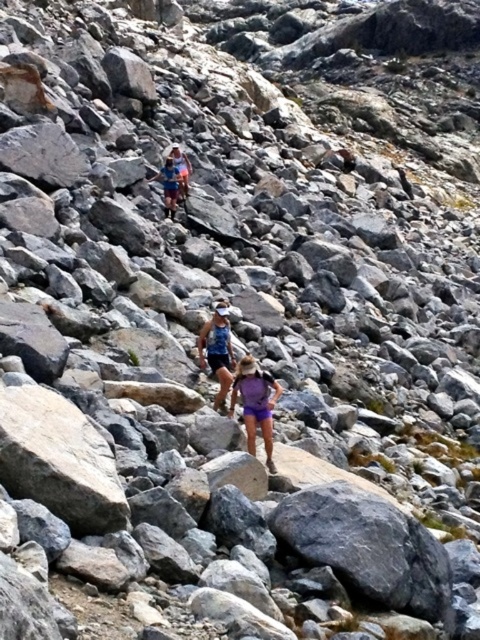
Is purple fabric backpack at center above blue fabric shorts at center?

Incorrect, purple fabric backpack at center is not positioned above blue fabric shorts at center.

Does purple fabric backpack at center have a greater width compared to blue fabric shorts at center?

In fact, purple fabric backpack at center might be narrower than blue fabric shorts at center.

Image resolution: width=480 pixels, height=640 pixels. Find the location of `purple fabric backpack at center`. purple fabric backpack at center is located at coordinates (255, 403).

At what (x,y) coordinates should I click in order to perform the action: click on purple fabric backpack at center. Please return your answer as a coordinate pair (x, y). Image resolution: width=480 pixels, height=640 pixels. Looking at the image, I should click on (255, 403).

Is point (262, 404) farther from camera compared to point (182, 161)?

No.

Is purple fabric backpack at center further to camera compared to matte blue backpack at center?

No.

Which is behind, point (251, 451) or point (177, 172)?

The point (177, 172) is more distant.

I want to click on purple fabric backpack at center, so click(x=255, y=403).

Does matte blue tank top at center appear on the right side of blue fabric shorts at center?

Correct, you'll find matte blue tank top at center to the right of blue fabric shorts at center.

Does matte blue tank top at center have a greater width compared to blue fabric shorts at center?

No.

The height and width of the screenshot is (640, 480). Identify the location of matte blue tank top at center. coord(216,349).

This screenshot has width=480, height=640. In order to click on matte blue tank top at center in this screenshot , I will do `click(216, 349)`.